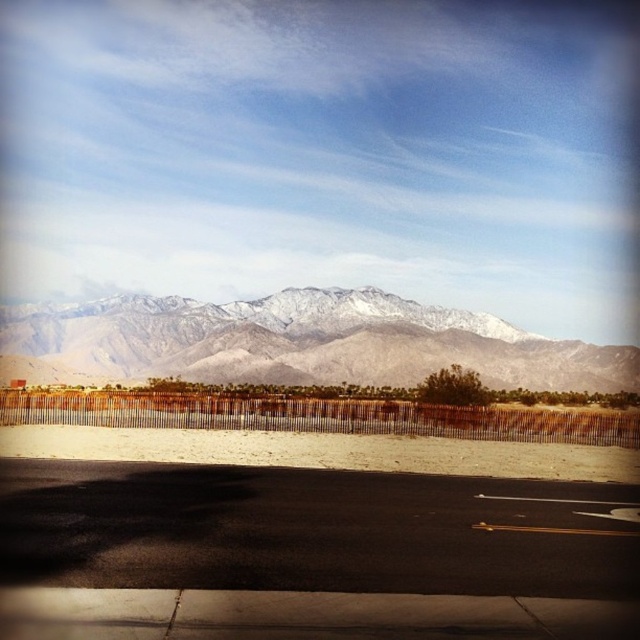
You are a hiker planning to take a photo of the black asphalt road at lower center and the snowy gray mountain range at upper center. Which object should you focus on first if you want to capture both in one frame without moving the camera?

The black asphalt road at lower center has a smaller size compared to the snowy gray mountain range at upper center, so you should focus on the snowy gray mountain range at upper center first since it is larger and will require more attention in the frame.